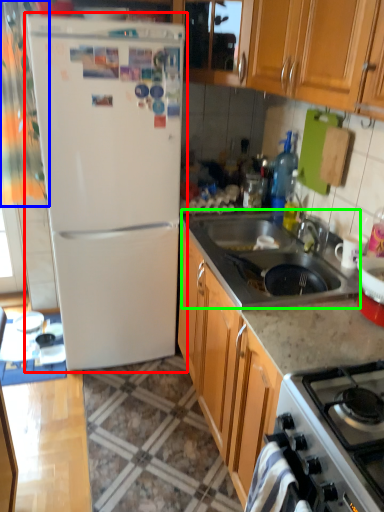
Question: Estimate the real-world distances between objects in this image. Which object is closer to refrigerator (highlighted by a red box), curtain (highlighted by a blue box) or sink (highlighted by a green box)?

Choices:
 (A) curtain
 (B) sink

Answer: (A)